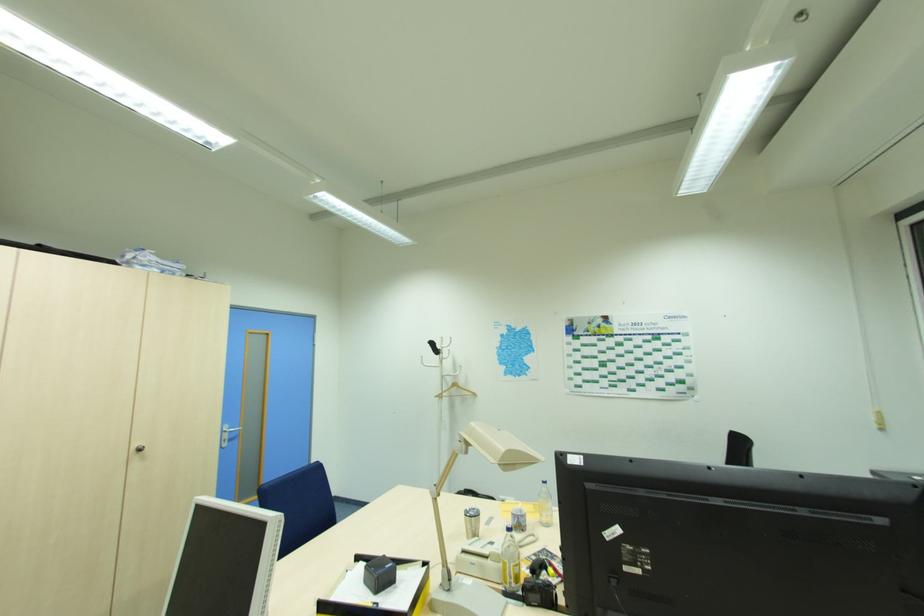
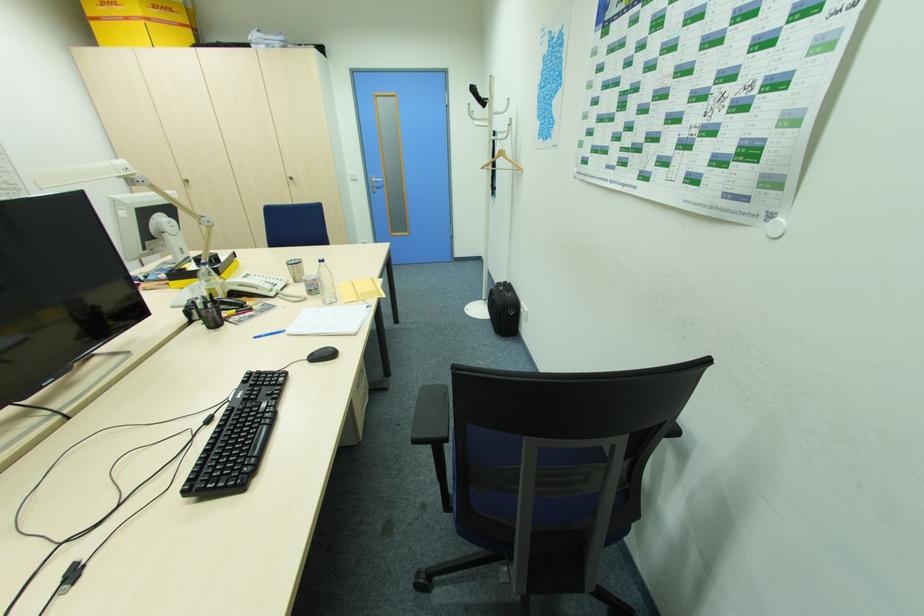
In the second image, find the point that corresponds to [546,485] in the first image.

(324, 264)